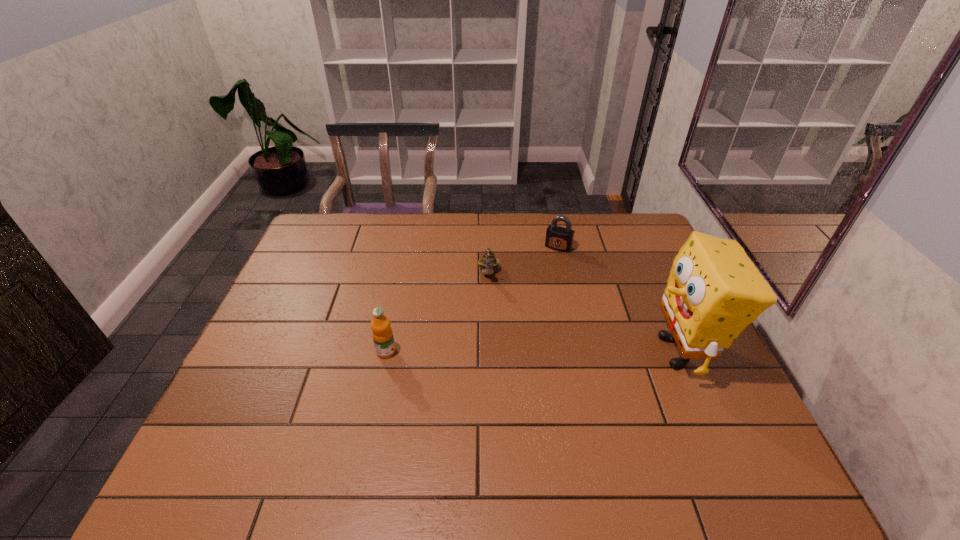
The width and height of the screenshot is (960, 540). I want to click on free spot on the desktop that is between the second tallest object and the rightmost object and is positioned on the face of the snail, so click(x=491, y=352).

You are a GUI agent. You are given a task and a screenshot of the screen. Output one action in this format:
    pyautogui.click(x=<x>, y=<y>)
    Task: Click on the free spot on the desktop that is between the third shortest object and the tallest object and is positioned on the front of the third object from left to right near the keyhole
    This screenshot has width=960, height=540.
    Given the screenshot: What is the action you would take?
    pyautogui.click(x=507, y=352)